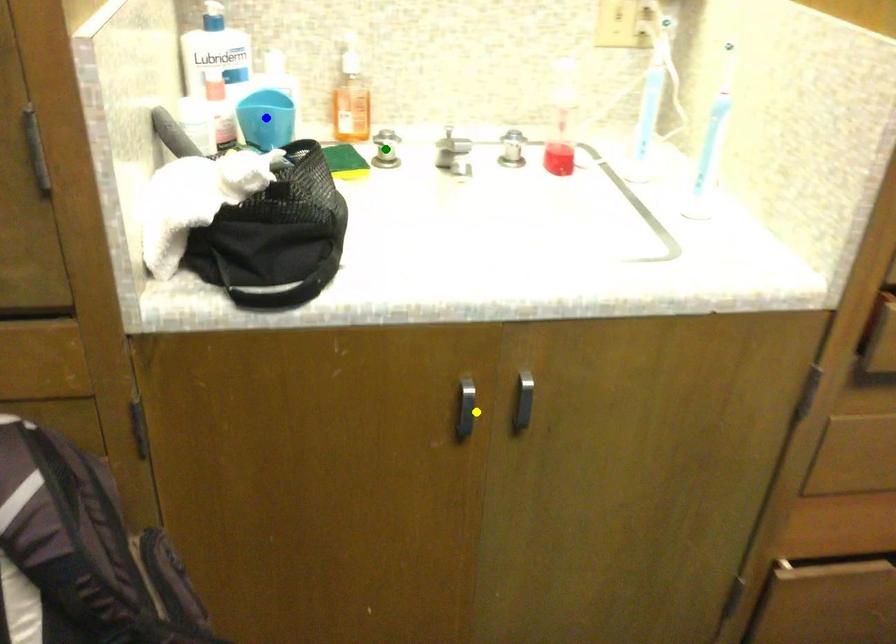
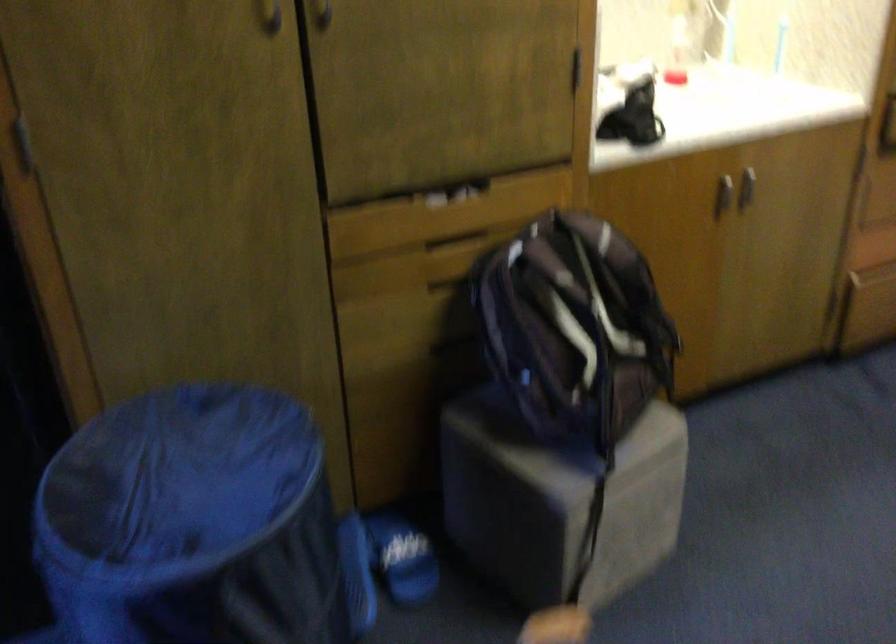
I am providing you with two images of the same scene from different viewpoints. Three points are marked in image1. Which point corresponds to a part or object that is occluded in image2?In image1, three points are marked. Which of them correspond to a part or object that is occluded in image2?Among the three points shown in image1, which one corresponds to a part or object that is no longer visible due to occlusion in image2?

Invisible in image2: green point, blue point.